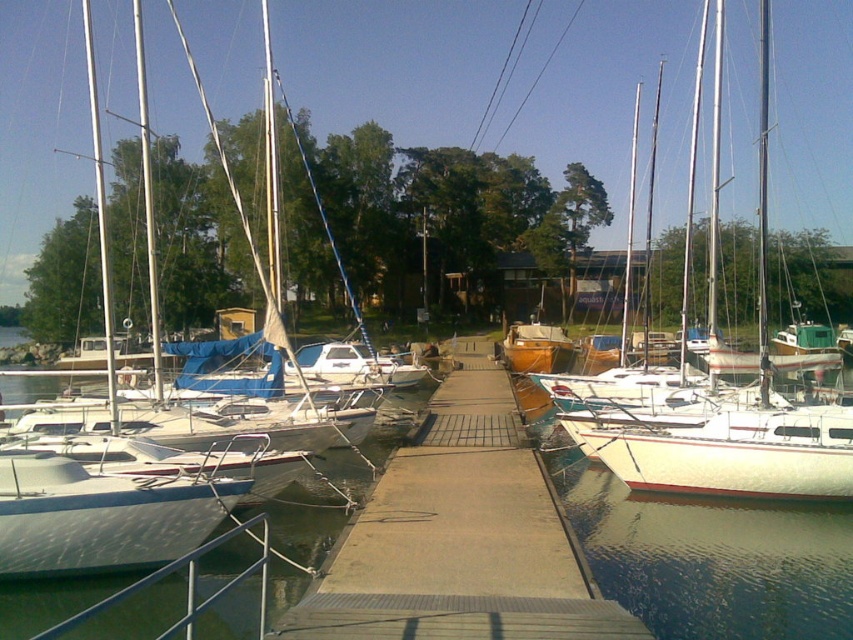
Describe the element at coordinates (706, 554) in the screenshot. I see `clear water at dock center` at that location.

Does clear water at dock center have a larger size compared to smooth concrete dock at center?

Yes, clear water at dock center is bigger than smooth concrete dock at center.

Locate an element on the screen. The height and width of the screenshot is (640, 853). clear water at dock center is located at coordinates pyautogui.click(x=706, y=554).